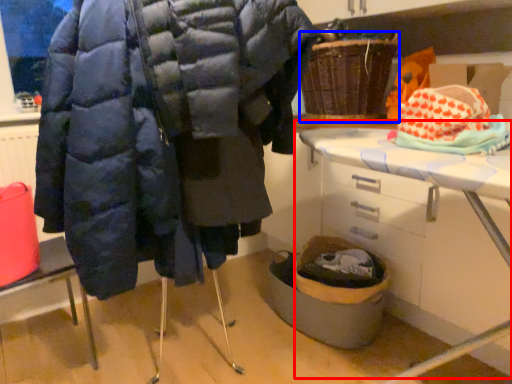
Question: Which object is closer to the camera taking this photo, table (highlighted by a red box) or basket (highlighted by a blue box)?

Choices:
 (A) table
 (B) basket

Answer: (A)